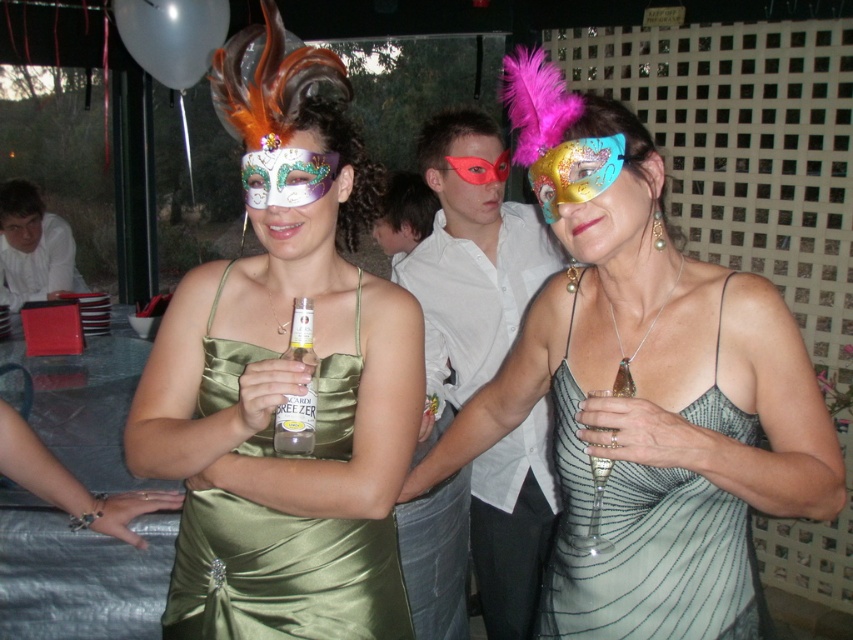
Question: Is clear glass bottle at center above matte white face at center?

Choices:
 (A) yes
 (B) no

Answer: (B)

Question: Considering the real-world distances, which object is farthest from the matte red mask at center?

Choices:
 (A) white cotton shirt at center
 (B) matte white mask at center
 (C) metallic gold mask at center

Answer: (C)

Question: From the image, what is the correct spatial relationship of white cotton shirt at center in relation to matte white face at center?

Choices:
 (A) right
 (B) left

Answer: (A)

Question: Which is nearer to the matte white mask at center?

Choices:
 (A) matte white face at center
 (B) matte white face at upper left
 (C) clear glass bottle at center

Answer: (C)

Question: Can you confirm if white cotton shirt at center is smaller than matte white face at center?

Choices:
 (A) no
 (B) yes

Answer: (A)

Question: Which of the following is the farthest from the observer?

Choices:
 (A) (567, 310)
 (B) (439, 200)
 (C) (614, 513)
 (D) (299, 339)

Answer: (B)